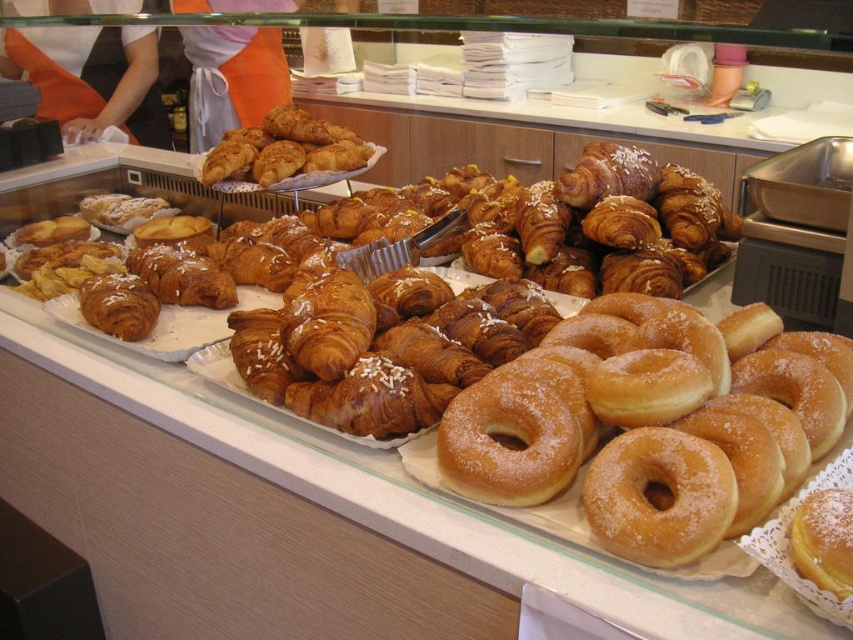
You are a customer at the bakery and want to pick up an item from the display case. You notice two points marked in the scene. The first point is at coordinate point(x=576, y=333) and the second is at point(x=283, y=112). Which of these points is closer to you as you stand in front of the display case?

Point(x=576, y=333) is in front of point(x=283, y=112), so it is closer to you.